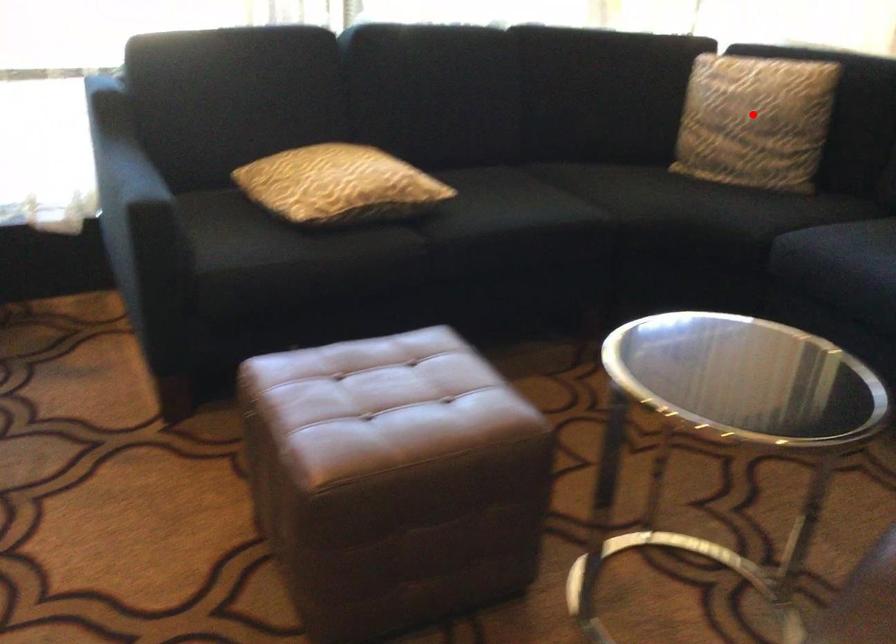
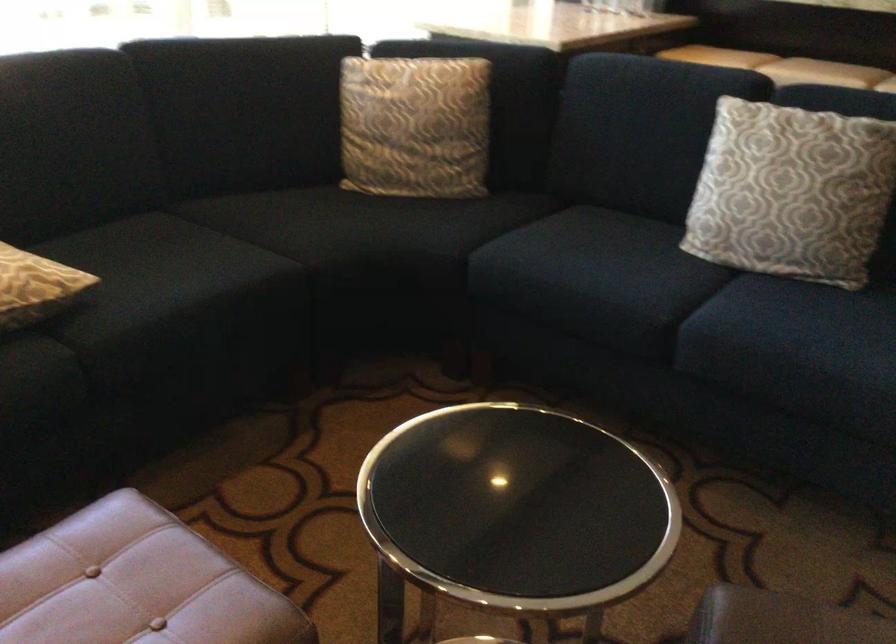
Where in the second image is the point corresponding to the highlighted location from the first image?

(415, 126)